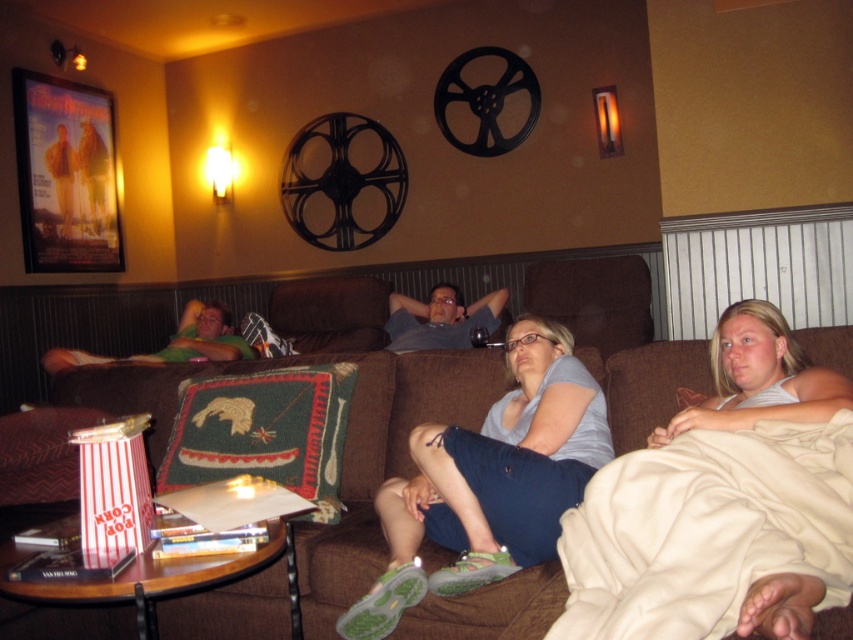
Question: Can you confirm if blue denim shorts at center is positioned to the left of matte gray shirt at center?

Choices:
 (A) no
 (B) yes

Answer: (A)

Question: Does blonde hair at center appear on the right side of matte gray shirt at center?

Choices:
 (A) no
 (B) yes

Answer: (B)

Question: Which point is farther to the camera?

Choices:
 (A) (432, 339)
 (B) (189, 356)
 (C) (717, 371)

Answer: (B)

Question: Which point appears closest to the camera in this image?

Choices:
 (A) (200, 328)
 (B) (577, 618)
 (C) (848, 392)
 (D) (463, 316)

Answer: (B)

Question: Is beige fleece blanket at lower right wider than blue denim shorts at center?

Choices:
 (A) no
 (B) yes

Answer: (A)

Question: Estimate the real-world distances between objects in this image. Which object is closer to the matte gray shirt at center?

Choices:
 (A) blue denim shorts at center
 (B) blonde hair at center

Answer: (A)